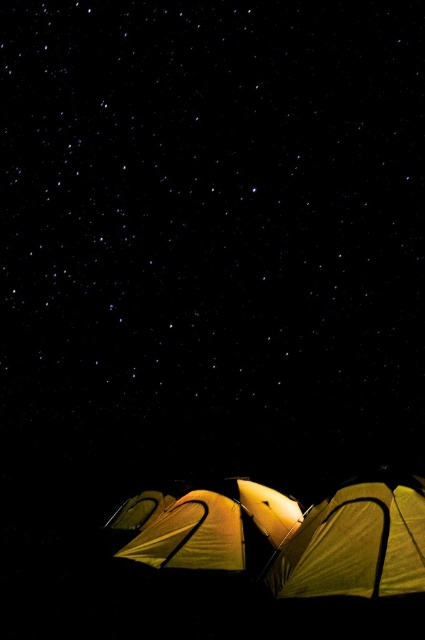
You are planning to set up a tent in this campsite. You have two tents available. One is the yellow fabric tent at lower right and the other is the matte yellow tent at lower center. Which tent has a thicker fabric?

The matte yellow tent at lower center has a thicker fabric than the yellow fabric tent at lower right.

You are a camper trying to set up your tent in the dark. You see two tents in the image, the yellow fabric tent at lower center and the matte yellow tent at lower center. Which one is located to the left?

The yellow fabric tent at lower center is positioned on the left side of matte yellow tent at lower center, so the yellow fabric tent at lower center is the one located to the left.

Looking at this image, you are standing in the campsite looking at the starry sky. There is a yellow fabric tent at lower right. Can you see the point at coordinate (x=357, y=541) from your current position?

The yellow fabric tent at lower right is represented by point (x=357, y=541), so yes, you can see the point at coordinate (x=357, y=541) from your current position.